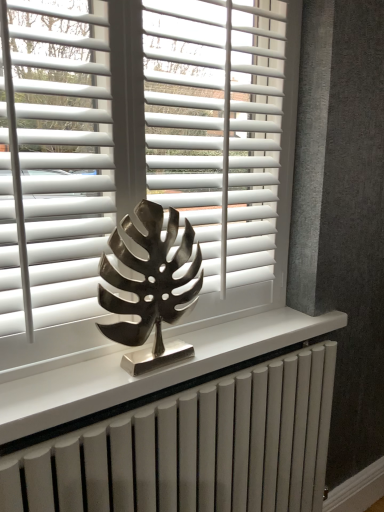
This screenshot has width=384, height=512. I want to click on empty space that is ontop of white metallic radiator at center, so click(x=212, y=379).